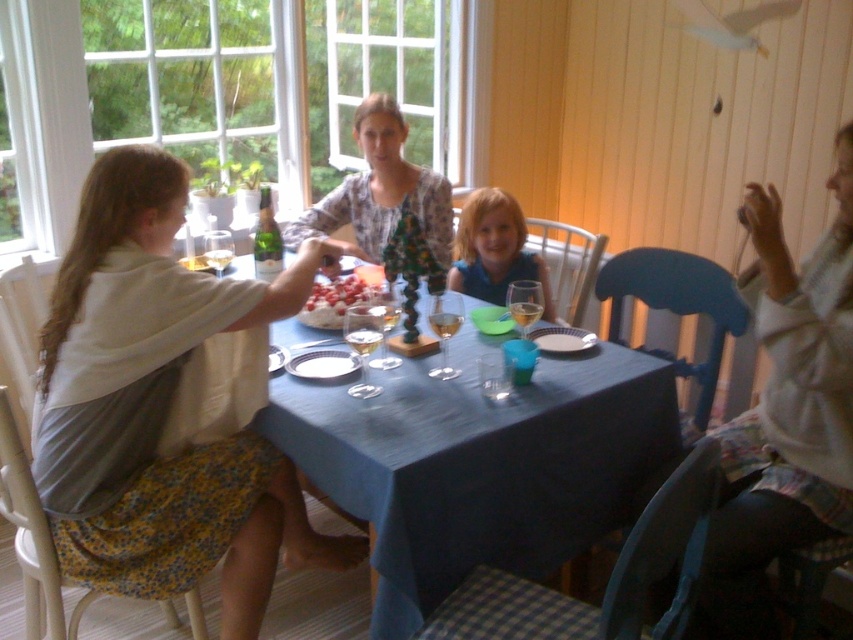
Question: Does blue fabric table at center have a larger size compared to floral print blouse at center?

Choices:
 (A) yes
 (B) no

Answer: (A)

Question: Which point is closer to the camera?

Choices:
 (A) (380, 292)
 (B) (453, 280)
 (C) (438, 262)

Answer: (A)

Question: Is floral print blouse at center thinner than blue fabric shirt at center?

Choices:
 (A) yes
 (B) no

Answer: (B)

Question: Which is farther from the blue fabric shirt at center?

Choices:
 (A) matte white blouse at upper left
 (B) floral print blouse at center

Answer: (A)

Question: Can you confirm if blue fabric table at center is positioned below blue fabric shirt at center?

Choices:
 (A) no
 (B) yes

Answer: (B)

Question: Which object is positioned closest to the blue fabric shirt at center?

Choices:
 (A) white fluffy cake at center
 (B) floral print blouse at center

Answer: (B)